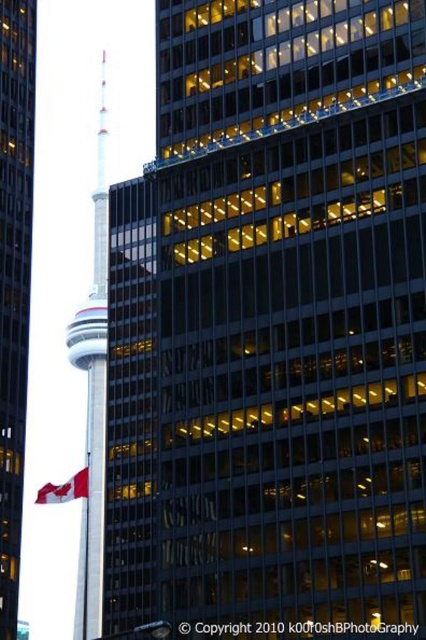
You are a photographer standing in front of the smooth glass tower at center and the red fabric flag at left. You want to capture a photo that includes both objects in the frame. Which object should you position closer to the edge of the frame to ensure both are fully visible?

The smooth glass tower at center is positioned over the red fabric flag at left, so you should position the smooth glass tower at center closer to the edge of the frame to ensure both are fully visible.

You are a drone operator who needs to fly a drone from the CN Tower to the glassy steel tower at center. According to the coordinates provided, what are the exact coordinates you should aim for?

The glassy steel tower at center is located at coordinates point (14, 280), so you should aim for point (14, 280).